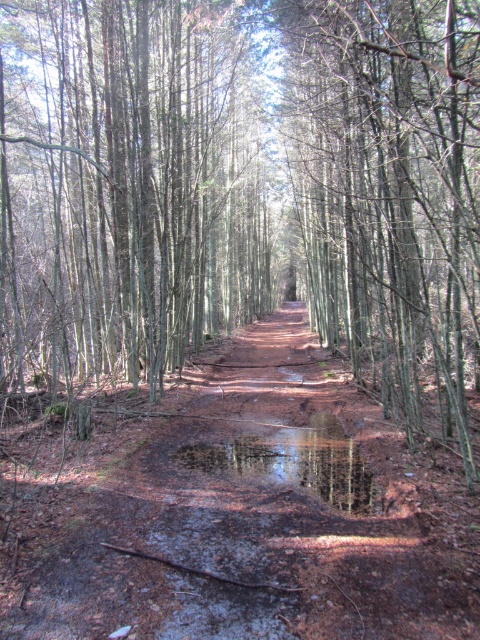
Question: Does brown dirt track at center have a smaller size compared to glossy reflective puddle at center?

Choices:
 (A) yes
 (B) no

Answer: (B)

Question: Which of the following is the closest to the observer?

Choices:
 (A) (312, 224)
 (B) (315, 426)

Answer: (B)

Question: Is smooth bark tree at center positioned in front of glossy reflective puddle at center?

Choices:
 (A) no
 (B) yes

Answer: (B)

Question: Does smooth bark tree at center have a greater width compared to glossy reflective puddle at center?

Choices:
 (A) no
 (B) yes

Answer: (B)

Question: Which object appears closest to the camera in this image?

Choices:
 (A) brown dirt track at center
 (B) smooth bark tree at center

Answer: (B)

Question: Which object is farther from the camera taking this photo?

Choices:
 (A) smooth bark tree at center
 (B) brown dirt track at center
 (C) glossy reflective puddle at center

Answer: (C)